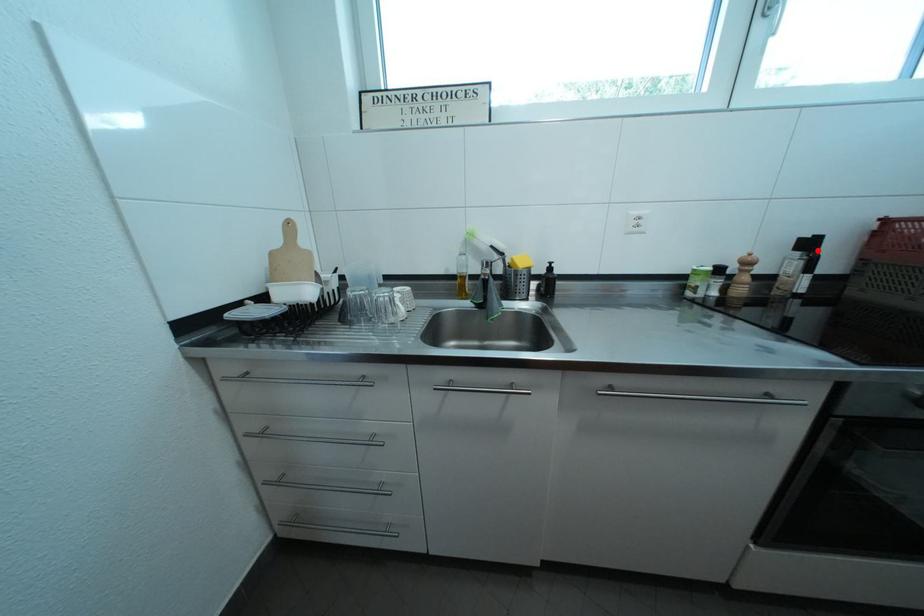
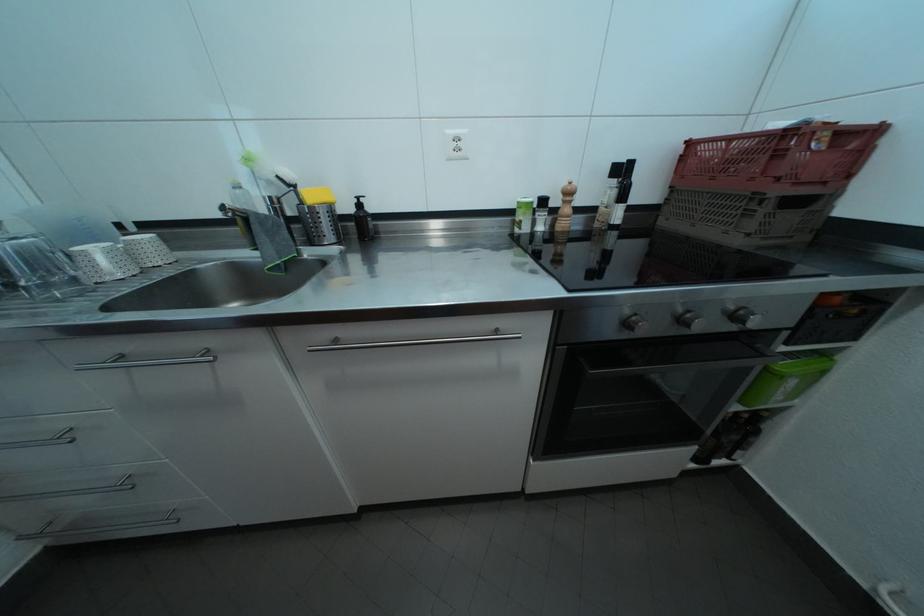
Locate, in the second image, the point that corresponds to the highlighted location in the first image.

(630, 176)